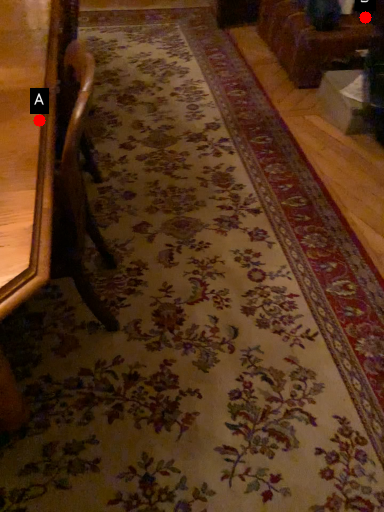
Question: Two points are circled on the image, labeled by A and B beside each circle. Which point is farther to the camera?

Choices:
 (A) A is further
 (B) B is further

Answer: (B)